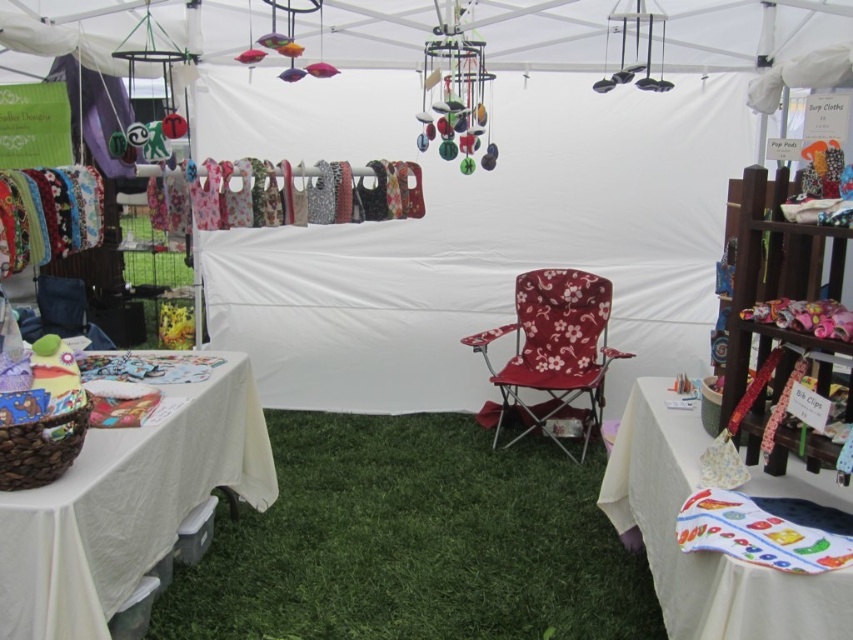
Can you confirm if white fabric table at lower left is positioned below floral fabric folding chair at center?

Yes.

Is white fabric table at lower left to the right of floral fabric folding chair at center from the viewer's perspective?

No, white fabric table at lower left is not to the right of floral fabric folding chair at center.

Between point (245, 452) and point (569, 324), which one is positioned in front?

Positioned in front is point (245, 452).

I want to click on white fabric table at lower left, so click(128, 504).

Does green artificial turf at center have a smaller size compared to printed fabric tablecloth at center?

Incorrect, green artificial turf at center is not smaller in size than printed fabric tablecloth at center.

Which is in front, point (282, 624) or point (776, 608)?

Point (776, 608) is more forward.

Locate an element on the screen. green artificial turf at center is located at coordinates (413, 541).

Can you confirm if white fabric table at lower left is taller than printed fabric tablecloth at center?

Correct, white fabric table at lower left is much taller as printed fabric tablecloth at center.

Who is positioned more to the left, white fabric table at lower left or printed fabric tablecloth at center?

Positioned to the left is white fabric table at lower left.

Who is more forward, (219, 404) or (822, 577)?

Point (822, 577) is in front.

The width and height of the screenshot is (853, 640). What are the coordinates of `white fabric table at lower left` in the screenshot? It's located at (128, 504).